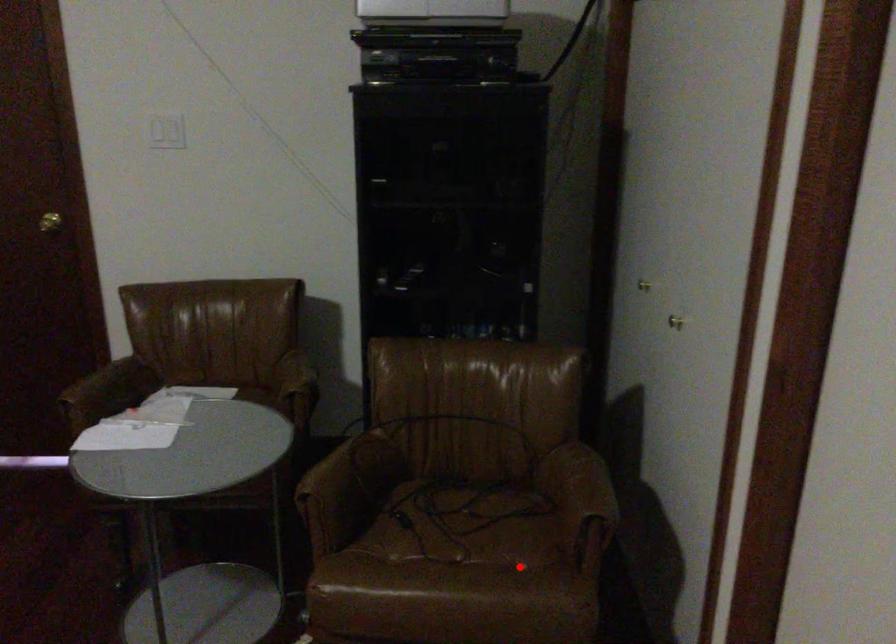
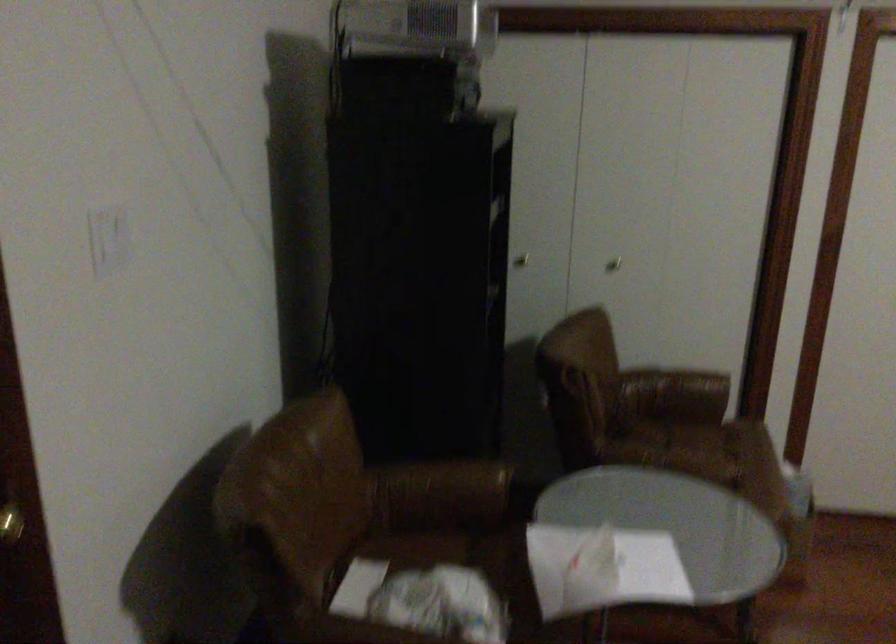
Question: I am providing you with two images of the same scene from different viewpoints. Image1 has a red point marked. In image2, the corresponding 3D location appears at what relative position? Reply with the corresponding letter.

Choices:
 (A) Closer
 (B) Farther

Answer: (B)